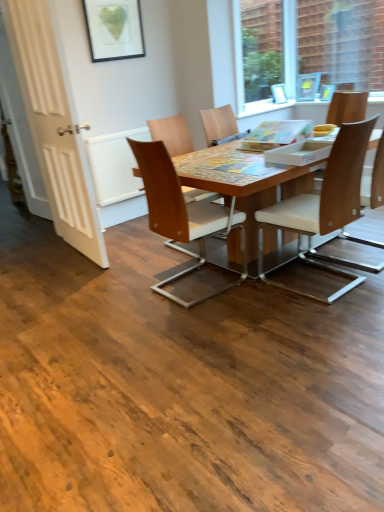
Where is `vacant space in front of woodenmaterial/texturetable at center`? This screenshot has width=384, height=512. vacant space in front of woodenmaterial/texturetable at center is located at coordinates (253, 355).